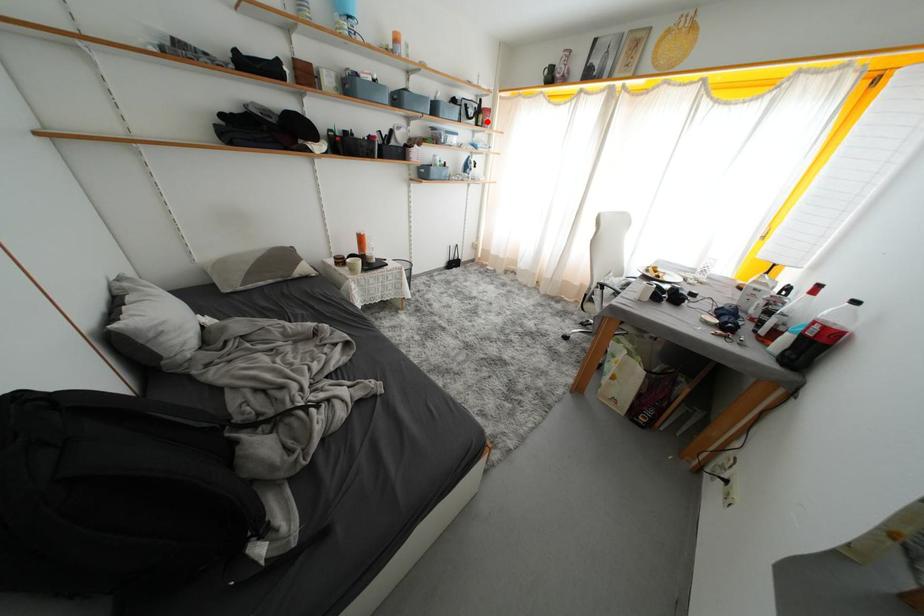
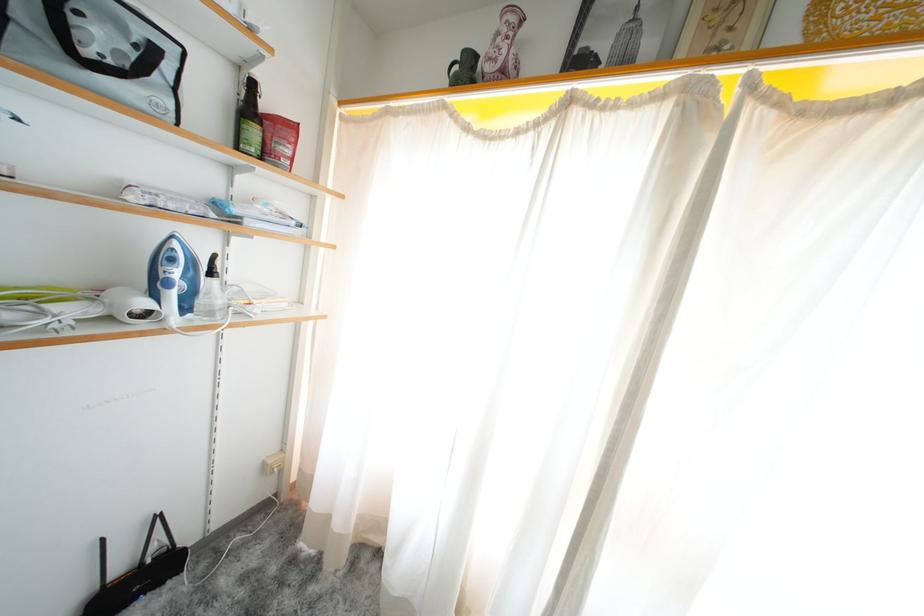
Question: I am providing you with two images of the same scene from different viewpoints. In image1, a red point is highlighted. Considering the same 3D point in image2, which of the following is correct?

Choices:
 (A) It is closer
 (B) It is farther

Answer: (B)